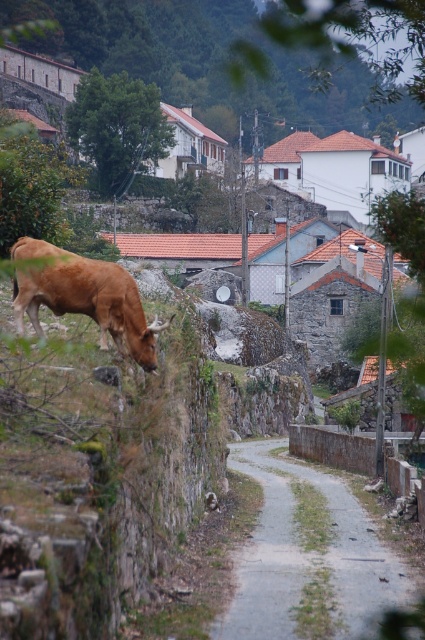
Question: Which point appears farthest from the camera in this image?

Choices:
 (A) (x=277, y=544)
 (B) (x=73, y=291)

Answer: (A)

Question: Which point appears farthest from the camera in this image?

Choices:
 (A) (45, 285)
 (B) (291, 500)

Answer: (B)

Question: Does gray gravel path at center have a lesser width compared to brown matte bull at left?

Choices:
 (A) yes
 (B) no

Answer: (B)

Question: Does gray gravel path at center appear over brown matte bull at left?

Choices:
 (A) no
 (B) yes

Answer: (A)

Question: Is gray gravel path at center smaller than brown matte bull at left?

Choices:
 (A) yes
 (B) no

Answer: (B)